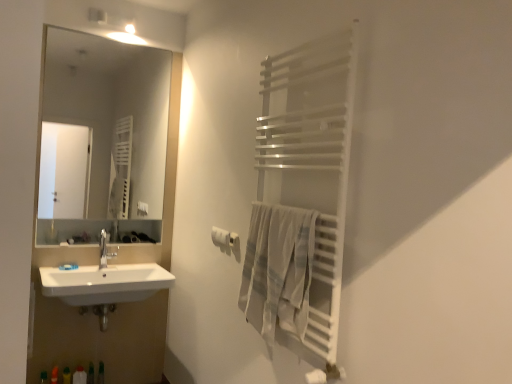
Question: Considering the positions of point (262, 168) and point (76, 382), is point (262, 168) closer or farther from the camera than point (76, 382)?

Choices:
 (A) farther
 (B) closer

Answer: (B)

Question: In the image, is white metallic towel rack at right on the left side or the right side of white plastic bottle at lower left, which appears as the first toiletry when viewed from the left?

Choices:
 (A) left
 (B) right

Answer: (B)

Question: Which object is positioned closest to the clear glass mirror at upper left?

Choices:
 (A) white matte towel bar at upper right
 (B) white plastic bottle at lower left, which appears as the first toiletry when viewed from the left
 (C) satin nickel faucet at sink left
 (D) translucent plastic bottle at lower left, which is the 1th toiletry in right-to-left order
 (E) light gray woven towel at right

Answer: (C)

Question: Which object is positioned closest to the white matte toilet paper at center?

Choices:
 (A) clear glass mirror at upper left
 (B) light gray woven towel at right
 (C) white metallic towel rack at right
 (D) satin nickel faucet at sink left
 (E) translucent plastic bottle at lower left, which is the 1th toiletry in right-to-left order

Answer: (B)